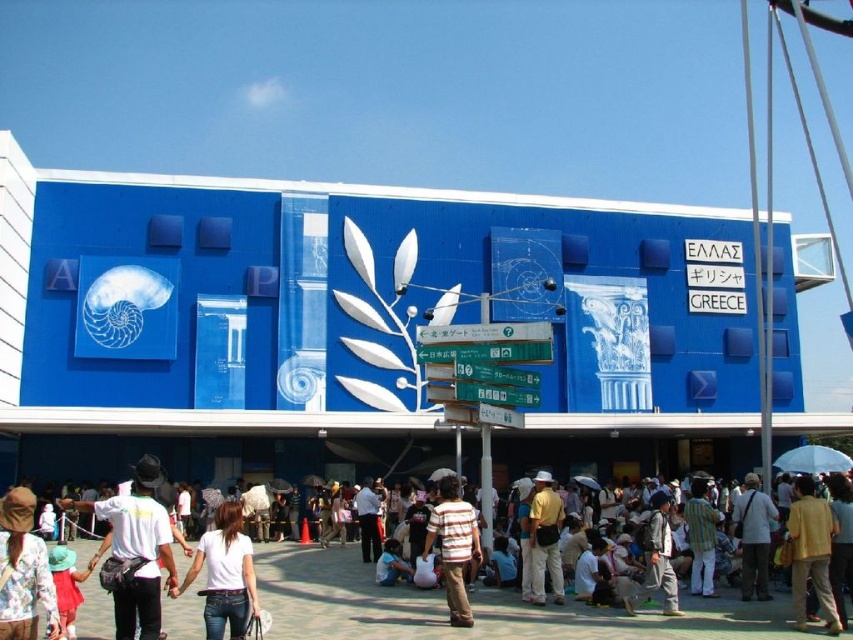
You are a photographer standing in front of the building with the blue facade. You want to take a photo that includes both the white cotton shirt at lower center and the brown striped shirt at center. Given that your camera has a maximum focus range of 15 feet, will you be able to capture both shirts clearly in the same photo?

The white cotton shirt at lower center and brown striped shirt at center are 18.45 feet apart from each other. Since the camera has a maximum focus range of 15 feet, the distance between the shirts exceeds this range. Therefore, you will not be able to capture both shirts clearly in the same photo.

You are standing in front of the building with the blue facade and notice the blue painted wall at center and the brown striped shirt at center. Which object is positioned higher up in the scene?

The blue painted wall at center is positioned higher up than the brown striped shirt at center.